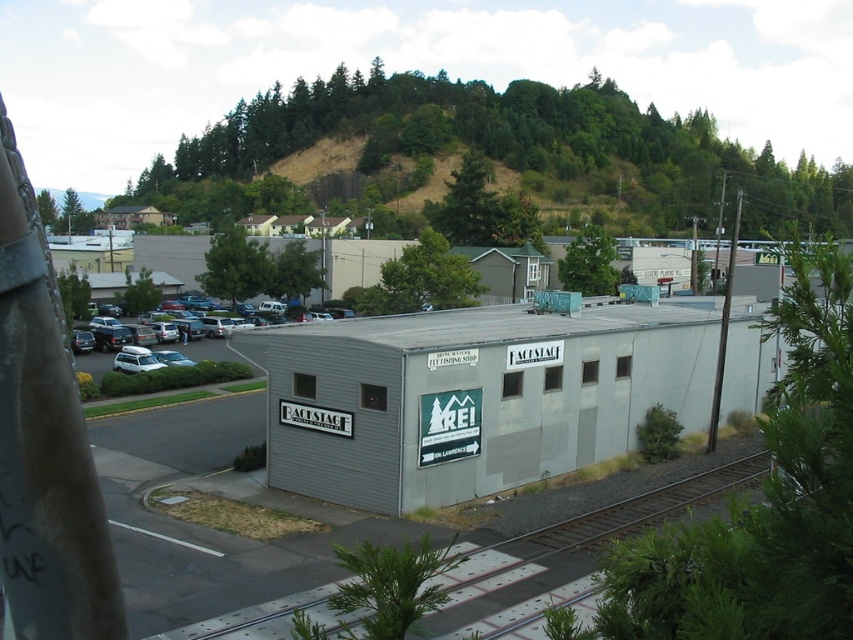
Is gray matte building at center further to camera compared to smooth asphalt road at lower left?

No.

Does point (500, 419) come behind point (762, 474)?

No, (500, 419) is closer to viewer.

You are a GUI agent. You are given a task and a screenshot of the screen. Output one action in this format:
    pyautogui.click(x=<x>, y=<y>)
    Task: Click on the gray matte building at center
    Image resolution: width=853 pixels, height=640 pixels.
    Given the screenshot: What is the action you would take?
    pos(473,397)

Can you confirm if gray matte building at center is bigger than white matte suv at center?

Yes, gray matte building at center is bigger than white matte suv at center.

Does gray matte building at center appear over white matte suv at center?

Correct, gray matte building at center is located above white matte suv at center.

What do you see at coordinates (473, 397) in the screenshot? The height and width of the screenshot is (640, 853). I see `gray matte building at center` at bounding box center [473, 397].

Find the location of a particular element. This screenshot has width=853, height=640. gray matte building at center is located at coordinates (473, 397).

The height and width of the screenshot is (640, 853). What do you see at coordinates (589, 529) in the screenshot?
I see `smooth asphalt road at lower left` at bounding box center [589, 529].

Does point (492, 570) come farther from viewer compared to point (216, 348)?

That is False.

At what (x,y) coordinates should I click in order to perform the action: click on smooth asphalt road at lower left. Please return your answer as a coordinate pair (x, y). Image resolution: width=853 pixels, height=640 pixels. Looking at the image, I should click on (589, 529).